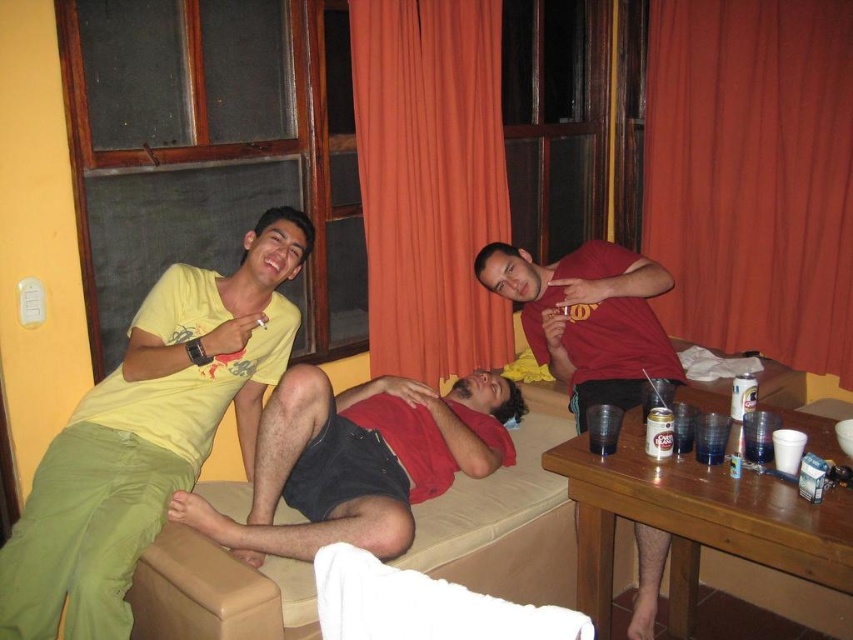
Question: Among these objects, which one is nearest to the camera?

Choices:
 (A) orange fabric curtain at right
 (B) beige fabric couch at center
 (C) yellow matte t-shirt at upper left
 (D) matte red t-shirt at center

Answer: (C)

Question: Which point appears farthest from the camera in this image?

Choices:
 (A) (262, 460)
 (B) (201, 538)
 (C) (239, 337)

Answer: (C)

Question: Can you confirm if orange fabric curtain at right is wider than matte red shirt at center?

Choices:
 (A) yes
 (B) no

Answer: (B)

Question: Can you confirm if orange fabric curtain at center is positioned to the left of beige fabric couch at center?

Choices:
 (A) no
 (B) yes

Answer: (B)

Question: Considering the relative positions of yellow matte t-shirt at upper left and matte red t-shirt at center in the image provided, where is yellow matte t-shirt at upper left located with respect to matte red t-shirt at center?

Choices:
 (A) left
 (B) right

Answer: (A)

Question: Among these points, which one is nearest to the camera?

Choices:
 (A) (486, 99)
 (B) (368, 524)

Answer: (B)